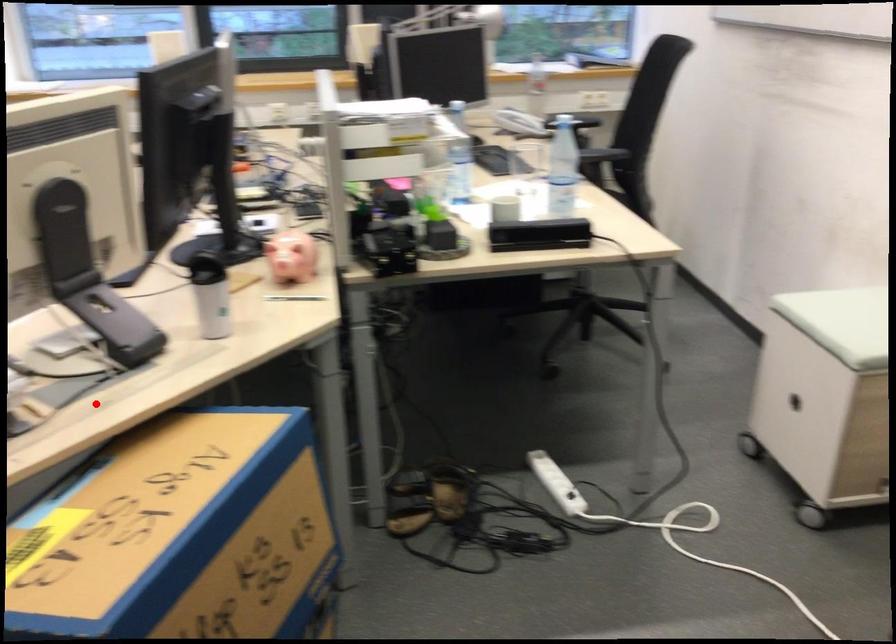
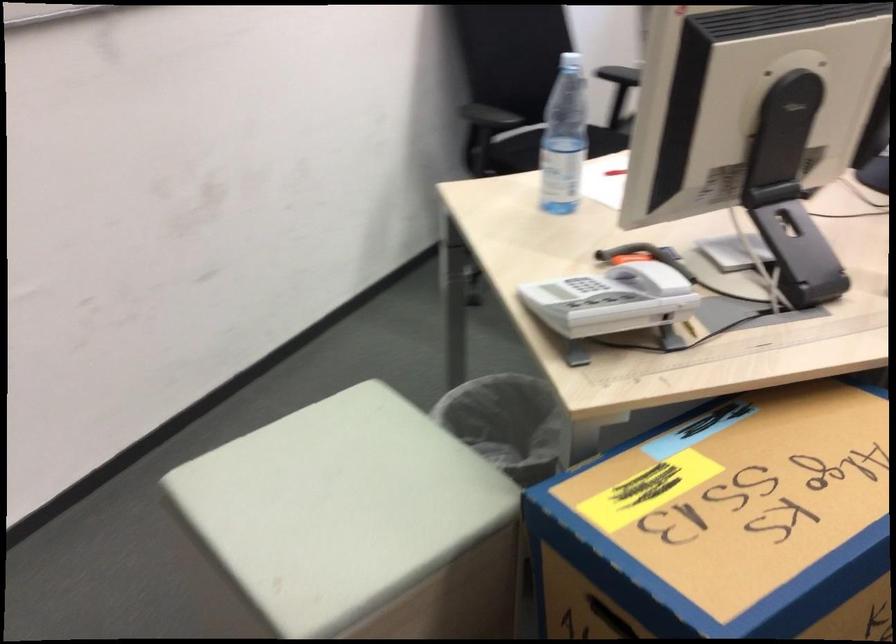
Where in the second image is the point corresponding to the highlighted location from the first image?

(746, 334)